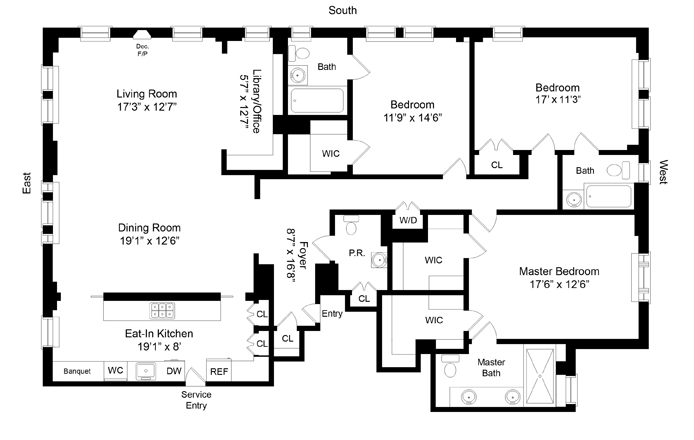
The image size is (694, 440). I want to click on 2nd wc, so click(431, 265).